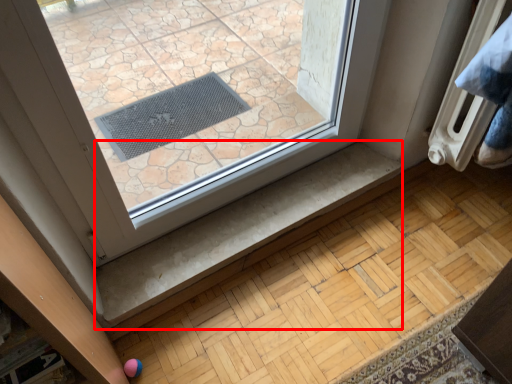
Question: From the image's perspective, where is stair (annotated by the red box) located relative to radiator?

Choices:
 (A) above
 (B) below

Answer: (B)